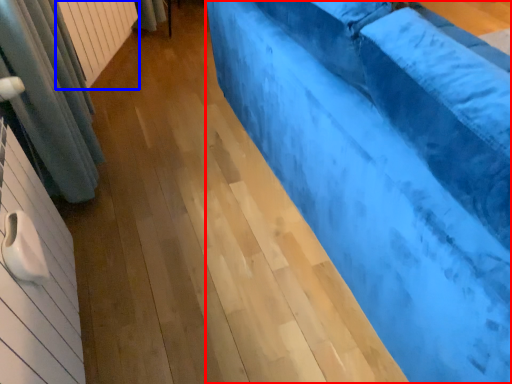
Question: Which object appears closest to the camera in this image, furniture (highlighted by a red box) or radiator (highlighted by a blue box)?

Choices:
 (A) furniture
 (B) radiator

Answer: (A)